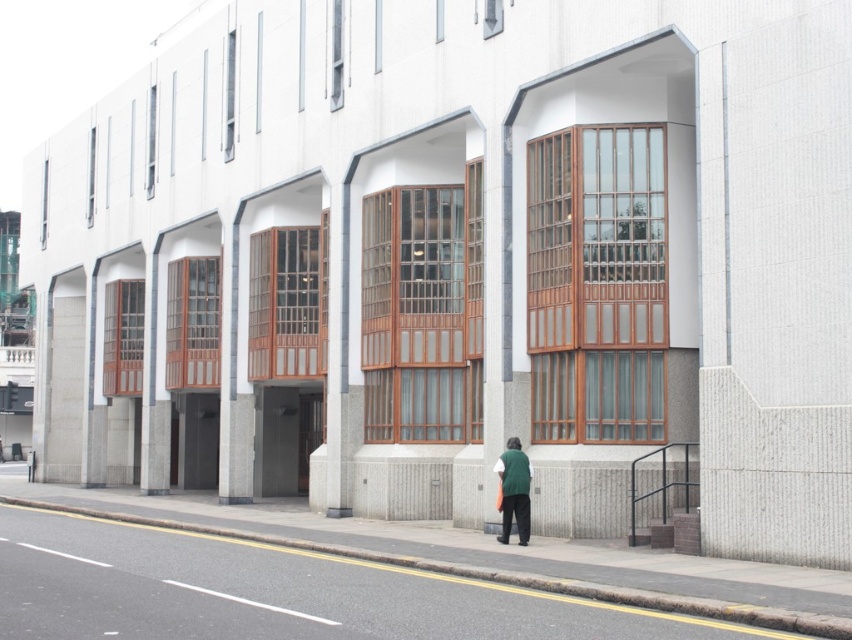
Which is behind, point (554, 580) or point (522, 525)?

Positioned behind is point (522, 525).

Between point (515, 582) and point (502, 534), which one is positioned in front?

Point (515, 582)

This screenshot has height=640, width=852. What do you see at coordinates (494, 573) in the screenshot?
I see `gray concrete curb at lower left` at bounding box center [494, 573].

Identify the location of gray concrete curb at lower left. The height and width of the screenshot is (640, 852). (494, 573).